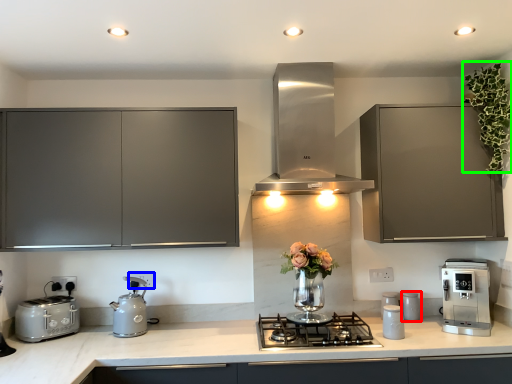
Question: Estimate the real-world distances between objects in this image. Which object is farther from kitchen appliance (highlighted by a red box), electric outlet (highlighted by a blue box) or floral arrangement (highlighted by a green box)?

Choices:
 (A) electric outlet
 (B) floral arrangement

Answer: (A)